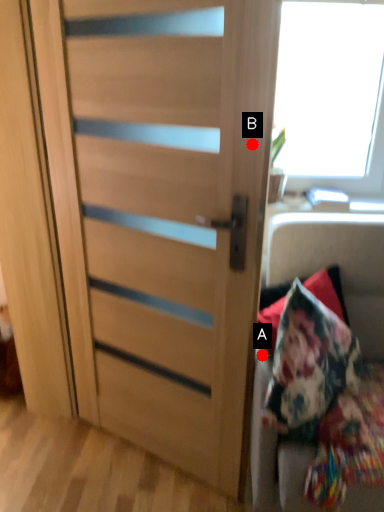
Question: Two points are circled on the image, labeled by A and B beside each circle. Which of the following is the closest to the observer?

Choices:
 (A) A is closer
 (B) B is closer

Answer: (B)